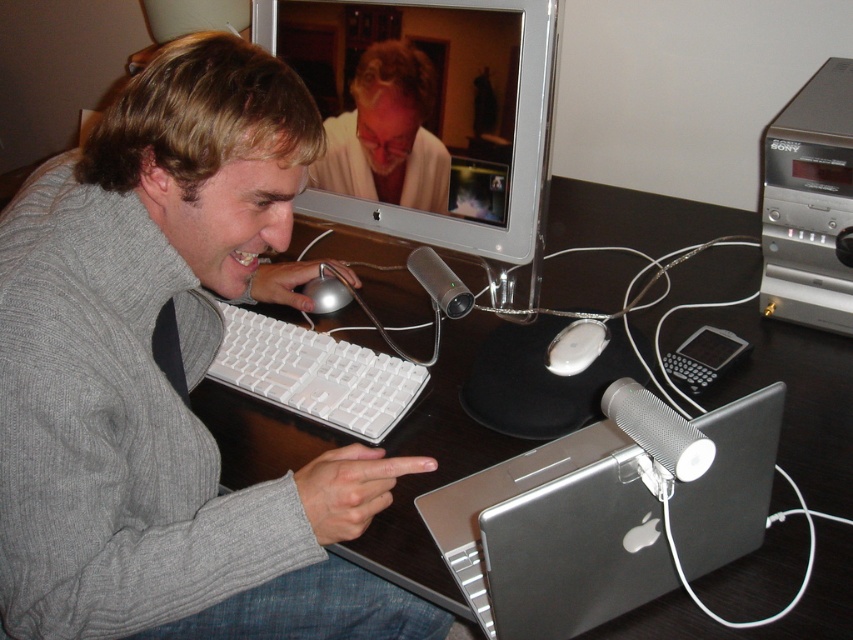
Who is positioned more to the left, gray sweater at center or black glossy computer desk at center?

Positioned to the left is gray sweater at center.

Can you confirm if gray sweater at center is shorter than black glossy computer desk at center?

In fact, gray sweater at center may be taller than black glossy computer desk at center.

Where is `gray sweater at center`? gray sweater at center is located at coordinates (169, 378).

Who is lower down, gray sweater at center or silver metallic mouse at center?

Positioned lower is gray sweater at center.

Between gray sweater at center and silver metallic mouse at center, which one has more height?

With more height is gray sweater at center.

Is point (254, 593) behind point (329, 294)?

No, it is not.

Locate an element on the screen. The image size is (853, 640). gray sweater at center is located at coordinates (169, 378).

Can you confirm if silver metallic laptop at center is positioned to the right of matte white shirt at upper center?

Correct, you'll find silver metallic laptop at center to the right of matte white shirt at upper center.

Is silver metallic laptop at center shorter than matte white shirt at upper center?

No, silver metallic laptop at center is not shorter than matte white shirt at upper center.

Is point (572, 589) farther from camera compared to point (340, 116)?

No, (572, 589) is closer to viewer.

This screenshot has height=640, width=853. Identify the location of silver metallic laptop at center. (601, 522).